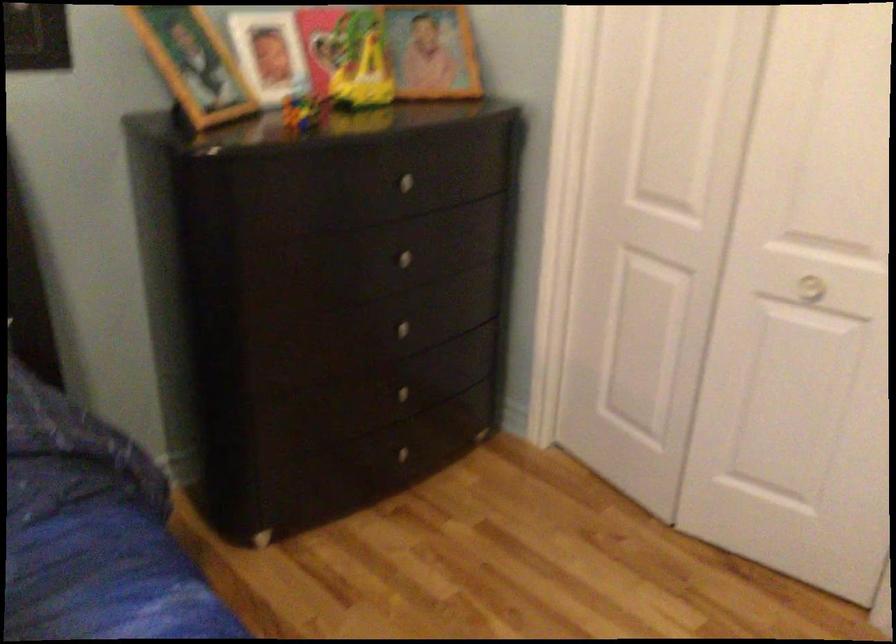
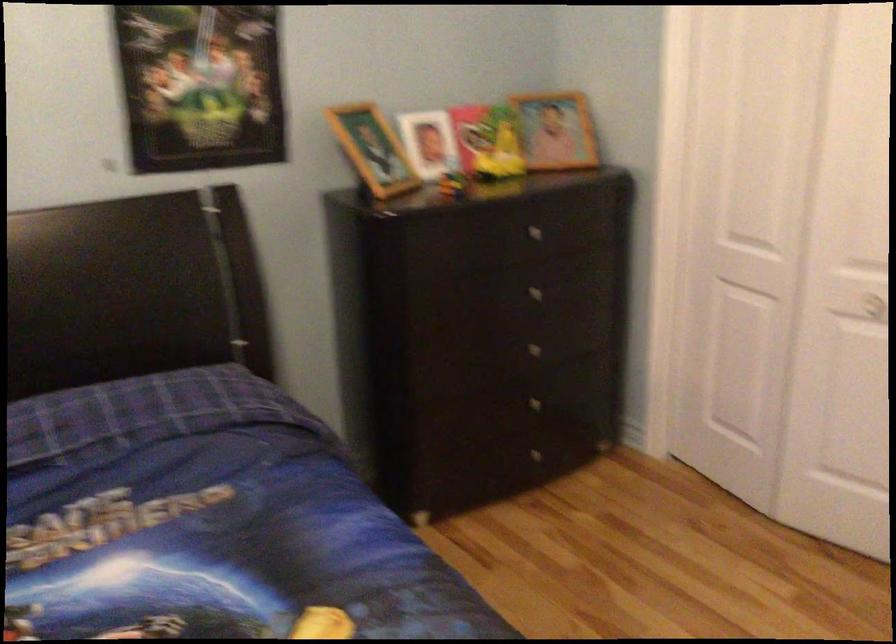
The point at (401,184) is marked in the first image. Where is the corresponding point in the second image?

(530, 230)